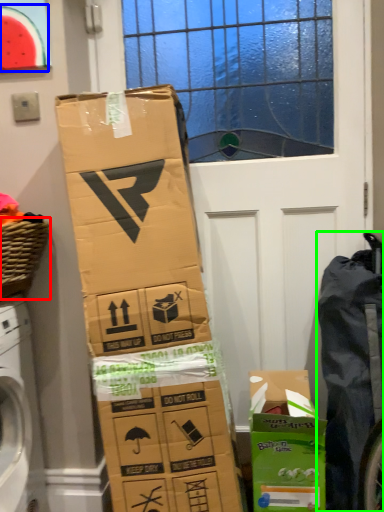
Question: Considering the real-world distances, which object is closest to basket (highlighted by a red box)? watermelon (highlighted by a blue box) or waste (highlighted by a green box).

Choices:
 (A) watermelon
 (B) waste

Answer: (A)